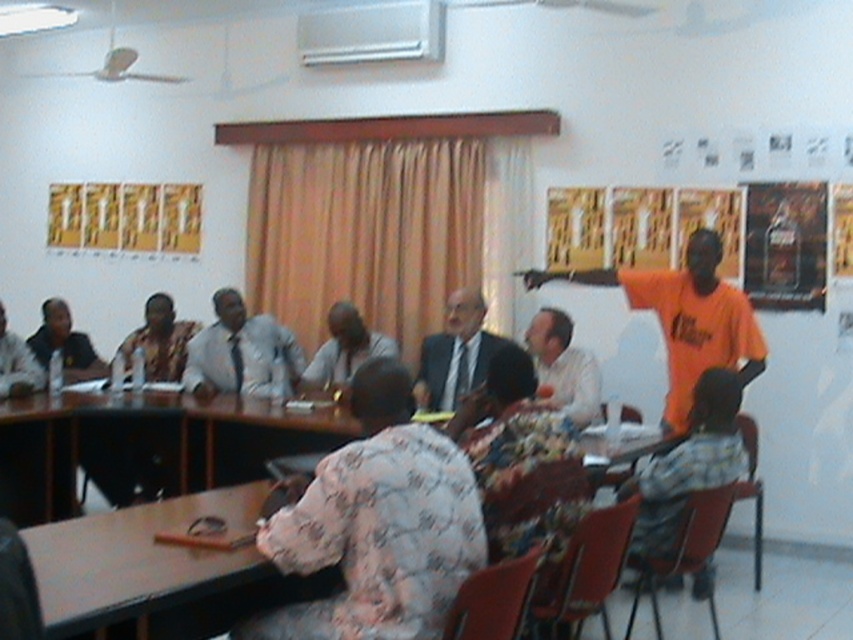
Can you confirm if brown wooden table at lower center is positioned to the right of matte black suit at center?

No, brown wooden table at lower center is not to the right of matte black suit at center.

Does brown wooden table at lower center appear on the left side of matte black suit at center?

Indeed, brown wooden table at lower center is positioned on the left side of matte black suit at center.

Does point (196, 506) lie behind point (457, 326)?

That is False.

Locate an element on the screen. Image resolution: width=853 pixels, height=640 pixels. brown wooden table at lower center is located at coordinates (138, 560).

Between orange t-shirt at upper right and matte black shirt at left, which one has more height?

With more height is orange t-shirt at upper right.

Can you confirm if orange t-shirt at upper right is taller than matte black shirt at left?

Yes, orange t-shirt at upper right is taller than matte black shirt at left.

Is point (618, 275) closer to viewer compared to point (56, 344)?

That is True.

Where is `orange t-shirt at upper right`? orange t-shirt at upper right is located at coordinates (683, 317).

This screenshot has height=640, width=853. What are the coordinates of `orange t-shirt at upper right` in the screenshot? It's located at (683, 317).

Between point (670, 304) and point (480, 362), which one is positioned in front?

Point (670, 304) is more forward.

Locate an element on the screen. The width and height of the screenshot is (853, 640). orange t-shirt at upper right is located at coordinates (683, 317).